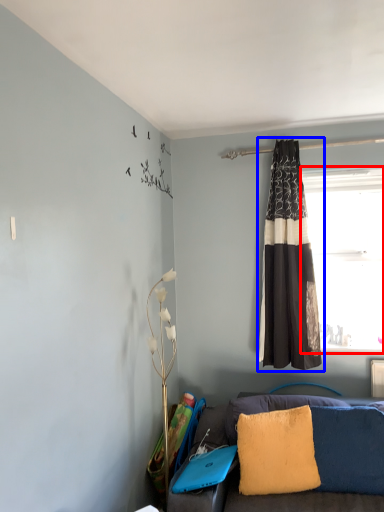
Question: Among these objects, which one is farthest to the camera, window (highlighted by a red box) or curtain (highlighted by a blue box)?

Choices:
 (A) window
 (B) curtain

Answer: (A)